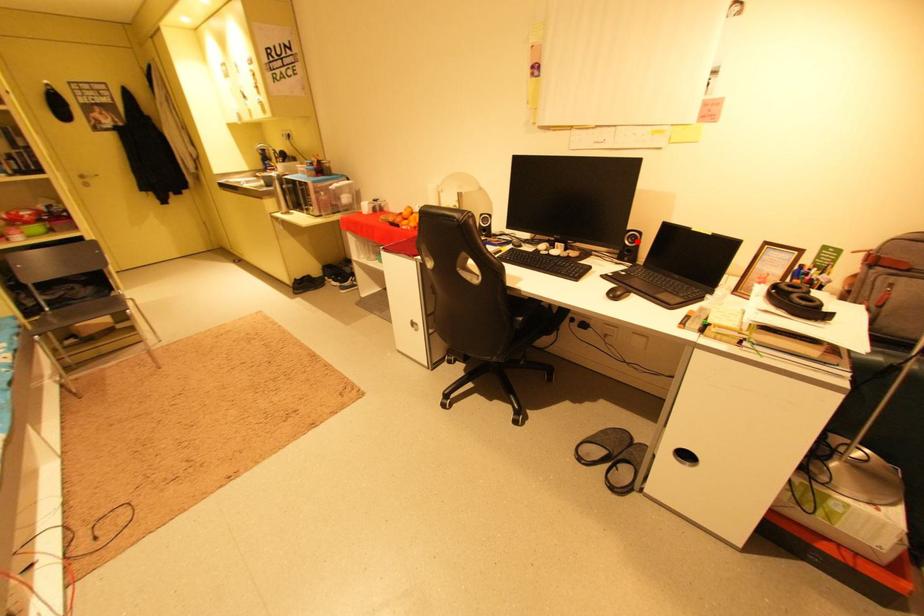
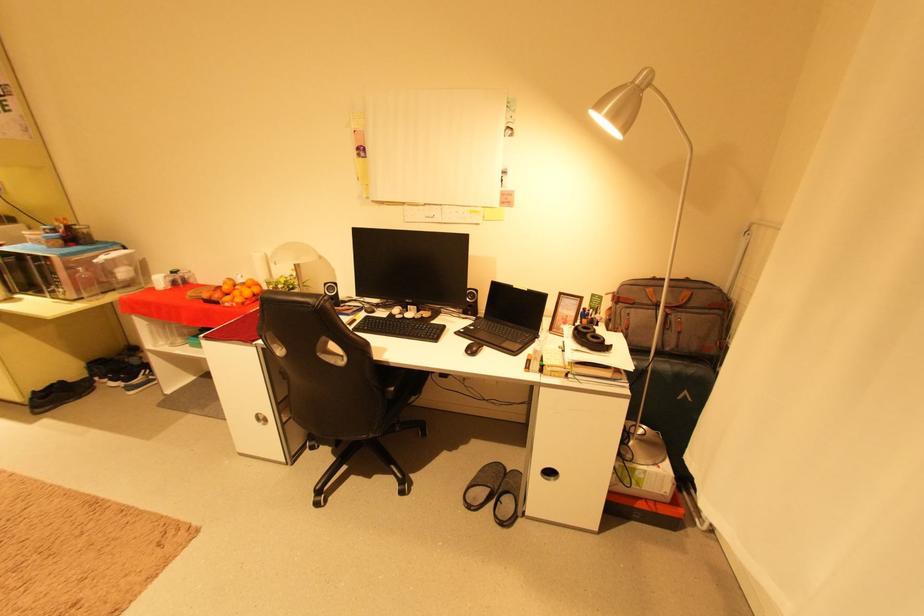
Find the pixel in the second image that matches the highlighted location in the first image.

(477, 298)